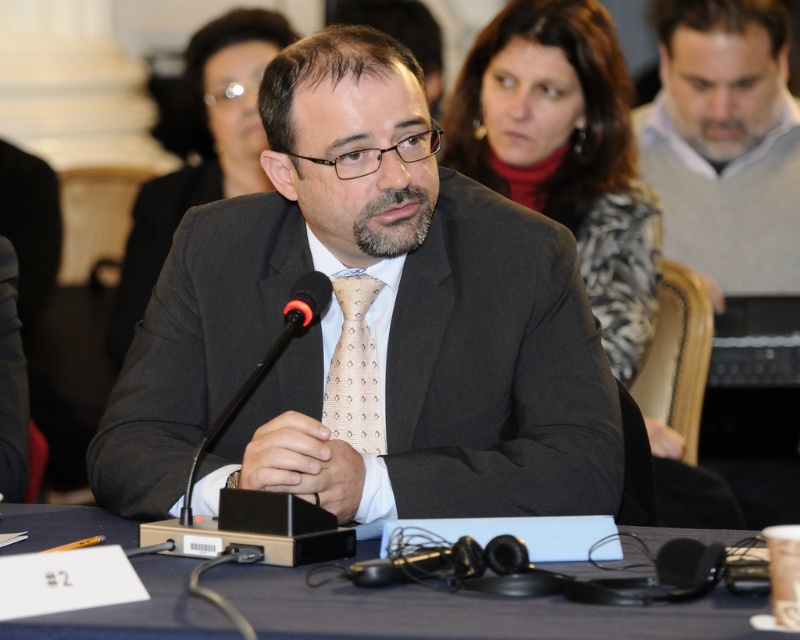
How much distance is there between gray sweater at right and blue fabric table at center?

gray sweater at right is 6.33 feet from blue fabric table at center.

From the picture: Is gray sweater at right smaller than blue fabric table at center?

Actually, gray sweater at right might be larger than blue fabric table at center.

This screenshot has width=800, height=640. What do you see at coordinates (725, 144) in the screenshot? I see `gray sweater at right` at bounding box center [725, 144].

You are a GUI agent. You are given a task and a screenshot of the screen. Output one action in this format:
    pyautogui.click(x=<x>, y=<y>)
    Task: Click on the gray sweater at right
    Image resolution: width=800 pixels, height=640 pixels.
    Given the screenshot: What is the action you would take?
    pyautogui.click(x=725, y=144)

Measure the distance between matte black suit at center and blue fabric table at center.

matte black suit at center and blue fabric table at center are 14.46 inches apart from each other.

Does matte black suit at center have a lesser height compared to blue fabric table at center?

Incorrect, matte black suit at center's height does not fall short of blue fabric table at center's.

Between point (476, 266) and point (289, 630), which one is positioned in front?

Positioned in front is point (289, 630).

You are a GUI agent. You are given a task and a screenshot of the screen. Output one action in this format:
    pyautogui.click(x=<x>, y=<y>)
    Task: Click on the matte black suit at center
    This screenshot has height=640, width=800.
    Given the screenshot: What is the action you would take?
    pyautogui.click(x=368, y=317)

Can you confirm if matte black suit at center is taller than black plastic microphone at center?

Correct, matte black suit at center is much taller as black plastic microphone at center.

Which is behind, point (518, 486) or point (308, 284)?

Point (308, 284)

Image resolution: width=800 pixels, height=640 pixels. I want to click on matte black suit at center, so click(x=368, y=317).